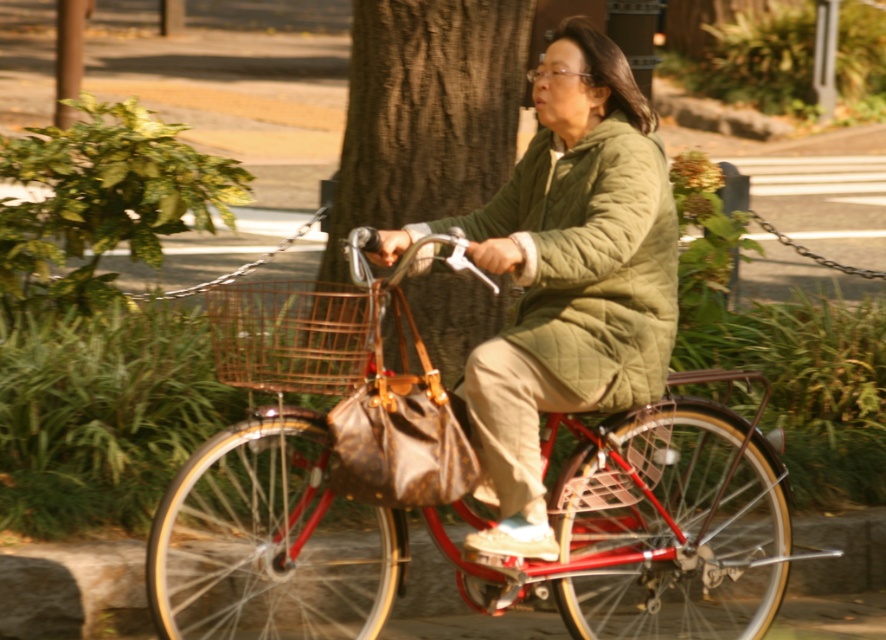
From the picture: Between metallic red bicycle at center and quilted olive green coat at center, which one has less height?

metallic red bicycle at center

The height and width of the screenshot is (640, 886). In order to click on metallic red bicycle at center in this screenshot , I will do `click(449, 492)`.

What do you see at coordinates (449, 492) in the screenshot? The height and width of the screenshot is (640, 886). I see `metallic red bicycle at center` at bounding box center [449, 492].

In order to click on metallic red bicycle at center in this screenshot , I will do `click(449, 492)`.

Between brown textured tree trunk at center and rusty metal basket at center, which one appears on the left side from the viewer's perspective?

From the viewer's perspective, rusty metal basket at center appears more on the left side.

Who is positioned more to the right, brown textured tree trunk at center or rusty metal basket at center?

From the viewer's perspective, brown textured tree trunk at center appears more on the right side.

Identify the location of brown textured tree trunk at center. (426, 113).

Where is `brown textured tree trunk at center`? The image size is (886, 640). brown textured tree trunk at center is located at coordinates tap(426, 113).

Is point (342, 339) more distant than point (587, 269)?

Yes, it is.

The height and width of the screenshot is (640, 886). Identify the location of metallic red bicycle at center. (449, 492).